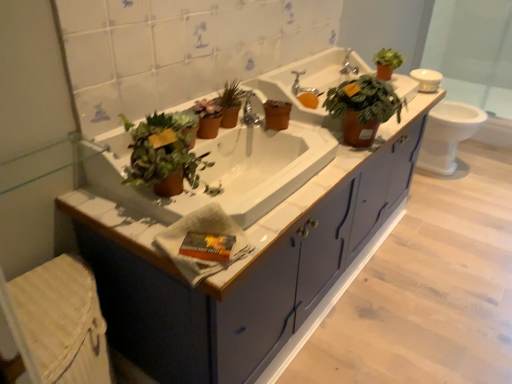
I want to click on blank space to the left of matte brown pot at center, so point(116,144).